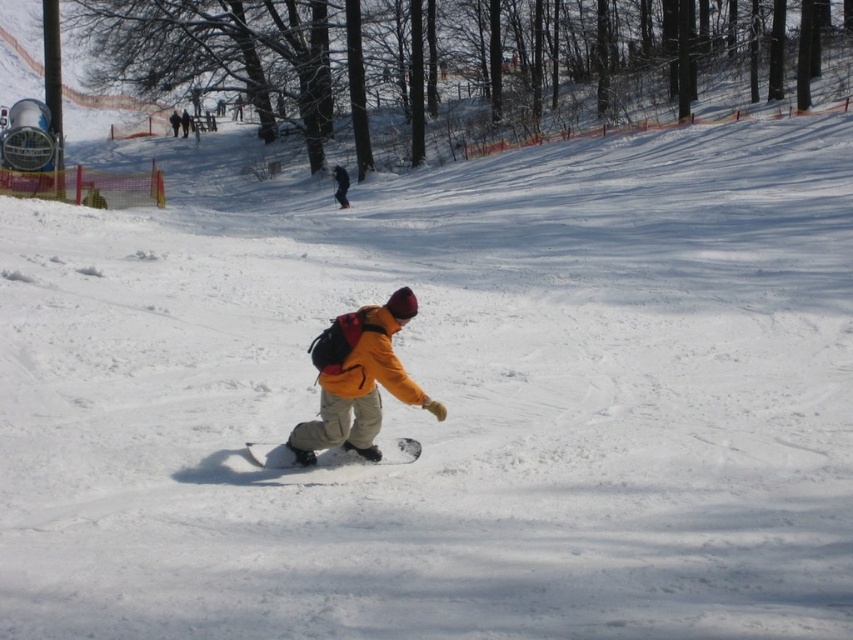
Is point (339, 355) closer to camera compared to point (341, 204)?

Yes, it is in front of point (341, 204).

What do you see at coordinates (352, 385) in the screenshot?
I see `matte yellow jacket at center` at bounding box center [352, 385].

This screenshot has height=640, width=853. In order to click on matte yellow jacket at center in this screenshot , I will do `click(352, 385)`.

Is brown wood tree at upper center shorter than yellow matte jacket at center?

No, brown wood tree at upper center is not shorter than yellow matte jacket at center.

Does point (247, 20) lie in front of point (335, 196)?

No, (247, 20) is behind (335, 196).

Between point (302, 70) and point (344, 188), which one is positioned in front?

Point (344, 188) is more forward.

Where is `brown wood tree at upper center`? The image size is (853, 640). brown wood tree at upper center is located at coordinates (463, 56).

Does point (340, 452) lie behind point (337, 186)?

No, (340, 452) is in front of (337, 186).

What do you see at coordinates (271, 454) in the screenshot? I see `white matte snowboard at center` at bounding box center [271, 454].

Is point (338, 449) more distant than point (334, 195)?

No, it is not.

Where is `white matte snowboard at center`? This screenshot has height=640, width=853. white matte snowboard at center is located at coordinates (271, 454).